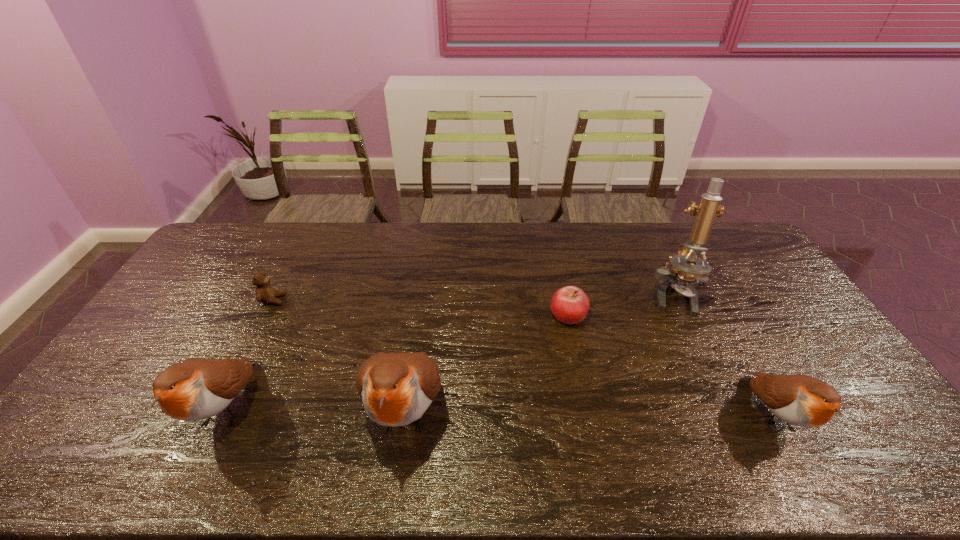
At what (x,y) coordinates should I click in order to perform the action: click on free spot between the shortest bird and the leftmost bird. Please return your answer as a coordinate pair (x, y). The height and width of the screenshot is (540, 960). Looking at the image, I should click on (499, 411).

Locate an element on the screen. The image size is (960, 540). vacant area between the tallest object and the fourth object from left to right is located at coordinates (620, 305).

The height and width of the screenshot is (540, 960). I want to click on unoccupied area between the microscope and the teddy bear, so click(473, 298).

Choose which object is the third nearest neighbor to the third object from left to right. Please provide its 2D coordinates. Your answer should be formatted as a tuple, i.e. [(x, y)], where the tuple contains the x and y coordinates of a point satisfying the conditions above.

[(265, 293)]

I want to click on object that stands as the closest to the third shortest object, so click(688, 268).

Where is `bird that stands as the second closest to the second bird from right to left`? bird that stands as the second closest to the second bird from right to left is located at coordinates (800, 400).

The width and height of the screenshot is (960, 540). Identify the location of bird that stands as the second closest to the third object from right to left. (800, 400).

At what (x,y) coordinates should I click in order to perform the action: click on free space that satisfies the following two spatial constraints: 1. at the face of the teddy bear; 2. on the left side of the third object from right to left. Please return your answer as a coordinate pair (x, y). Image resolution: width=960 pixels, height=540 pixels. Looking at the image, I should click on (265, 315).

This screenshot has width=960, height=540. I want to click on free space that satisfies the following two spatial constraints: 1. at the face of the teddy bear; 2. on the back side of the apple, so click(265, 315).